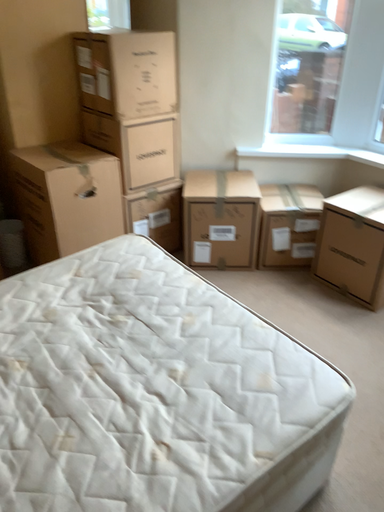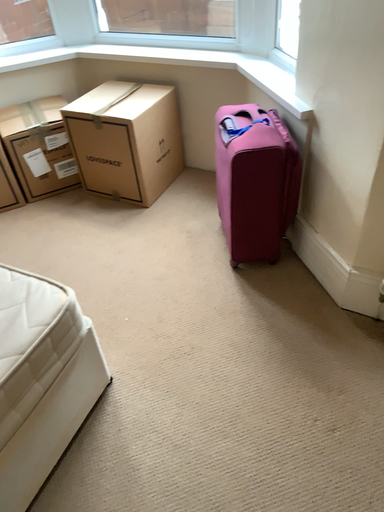
Question: How did the camera likely rotate when shooting the video?

Choices:
 (A) rotated upward
 (B) rotated downward

Answer: (B)